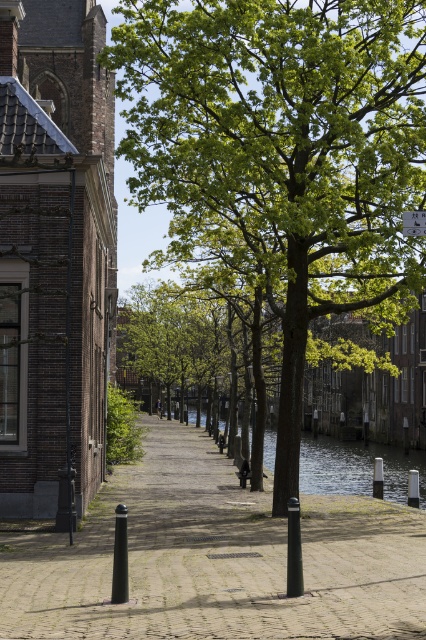
You are standing at the cobblestone pathway near the canal and see two points marked in the scene. The first point is at coordinates point (199, 586) and the second is at point (419, 221). Which point is closer to you?

Point (199, 586) is in front of point (419, 221), so the first point is closer to you.

You are standing on the cobblestone pathway next to the canal and want to take a photo of the green leafy tree at center. If your camera has a maximum focus range of 15 meters, will you be able to capture the tree clearly?

The green leafy tree at center is 14.50 meters away from the viewer. Since the camera can focus up to 15 meters, it is within range, so yes, you can capture the tree clearly.

You are standing on the cobblestone pathway next to the canal and want to take a photo of the green leafy tree at center. If you move 0.1 units to the right from your current position, will the tree still be in the center of your photo? Assume your camera has a standard field of view.

The green leafy tree at center is located at point [281,156]. Moving 0.1 units to the right would shift your position, but without knowing the exact camera field of view or the distance to the tree, it is impossible to determine if the tree remains centered. However, since the tree is already at the center point, a small shift might slightly move it but not necessarily out of frame.